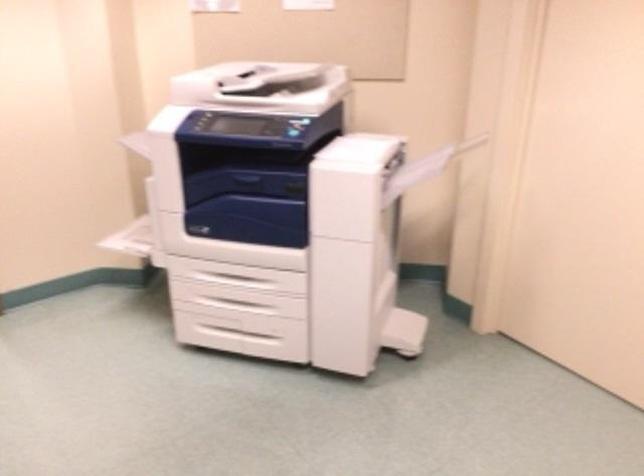
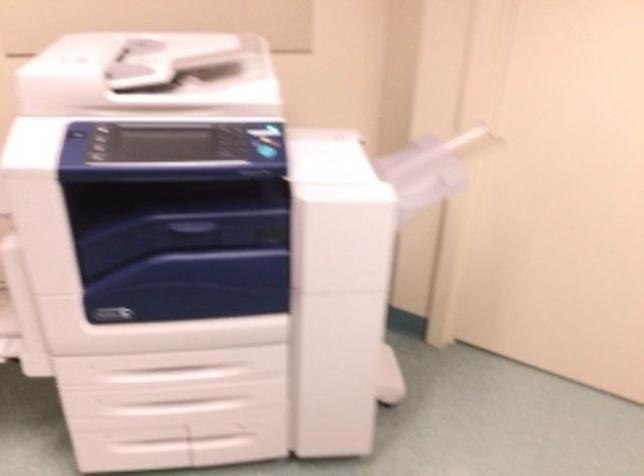
The point at [248,183] is marked in the first image. Where is the corresponding point in the second image?

(196, 231)